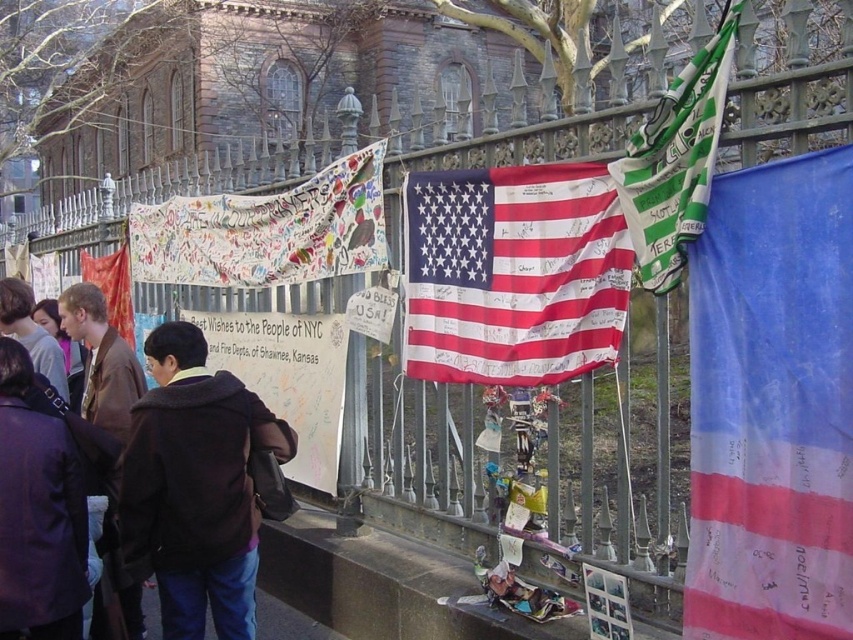
Is blue fabric flag at right to the left of matte purple jacket at lower left from the viewer's perspective?

In fact, blue fabric flag at right is to the right of matte purple jacket at lower left.

Is blue fabric flag at right positioned in front of matte purple jacket at lower left?

Yes.

Is point (750, 179) closer to camera compared to point (65, 509)?

Yes, it is.

This screenshot has height=640, width=853. Identify the location of blue fabric flag at right. (772, 404).

Based on the photo, can you confirm if white painted fabric at center is positioned to the left of brown leather jacket at center?

Incorrect, white painted fabric at center is not on the left side of brown leather jacket at center.

Between white painted fabric at center and brown leather jacket at center, which one appears on the left side from the viewer's perspective?

Positioned to the left is brown leather jacket at center.

Between point (323, 196) and point (102, 384), which one is positioned behind?

The point (323, 196) is behind.

Where is `white painted fabric at center`? white painted fabric at center is located at coordinates (267, 230).

Who is more distant from viewer, (605, 627) or (112, 285)?

The point (112, 285) is behind.

Where is `metallic silver photo album at center`? metallic silver photo album at center is located at coordinates (606, 604).